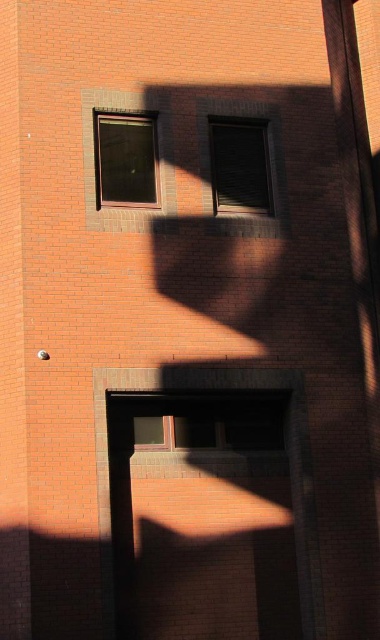
You are an architect analyzing the building facade. You observe the matte glass window at upper center and the matte glass window at center. Which window is positioned higher on the wall?

The matte glass window at upper center is positioned higher on the wall than the matte glass window at center because it is located above it according to the description.

You are a window installer who needs to place a new 1.2 meter wide decorative panel between the matte glass window at upper center and the matte glass window at center. Based on the scene description, will the panel fit between them?

The distance between the matte glass window at upper center and the matte glass window at center is 1.07 meters, which is shorter than the 1.2 meter wide panel. Therefore, the panel will not fit between them.

You are standing in front of the brick building and notice two points marked on the wall. The first point is at coordinates point (134,164) and the second is at point (226,134). Which point is closer to you?

Point (134,164) is closer to the camera than point (226,134), so the first point is closer to you.